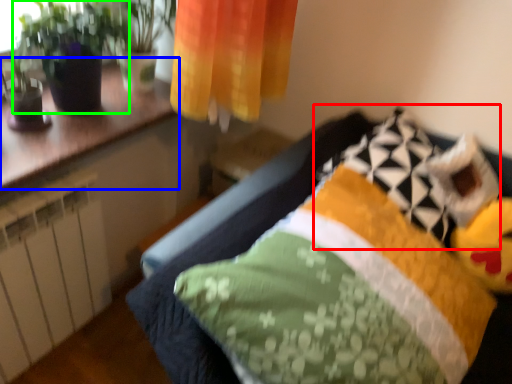
Question: Based on their relative distances, which object is nearer to pillow (highlighted by a red box)? Choose from counter top (highlighted by a blue box) and houseplant (highlighted by a green box).

Choices:
 (A) counter top
 (B) houseplant

Answer: (A)